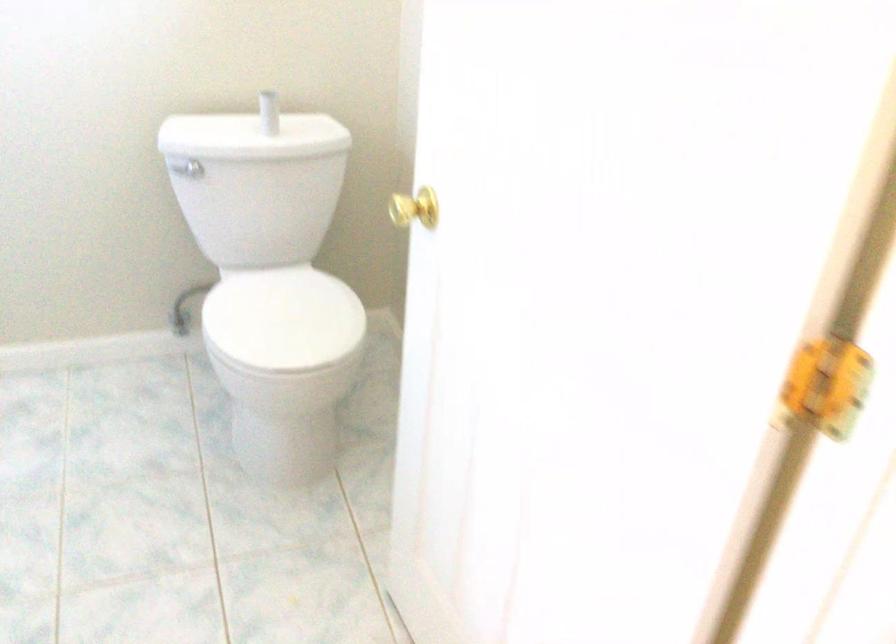
Where would you lift the white toilet lid? Please return your answer as a coordinate pair (x, y).

(282, 317)